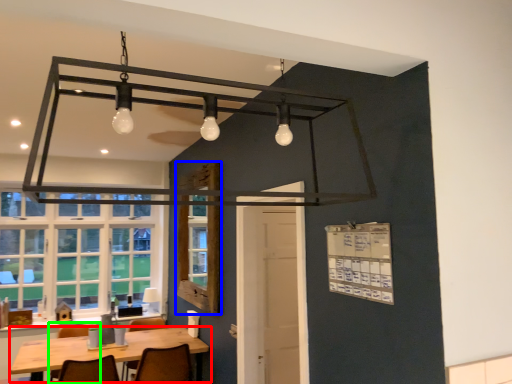
Question: Based on their relative distances, which object is farther from table (highlighted by a red box)? Choose from window screen (highlighted by a blue box) and chair (highlighted by a green box).

Choices:
 (A) window screen
 (B) chair

Answer: (A)